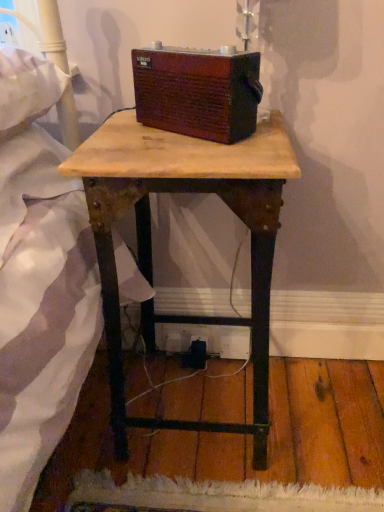
Describe the element at coordinates (197, 92) in the screenshot. I see `brown wood radio at center` at that location.

What is the approximate width of brown wood radio at center?

It is 10.28 centimeters.

Where is `brown wood radio at center`? The height and width of the screenshot is (512, 384). brown wood radio at center is located at coordinates (197, 92).

This screenshot has height=512, width=384. Describe the element at coordinates (151, 240) in the screenshot. I see `wooden table at center` at that location.

Image resolution: width=384 pixels, height=512 pixels. Find the location of `wooden table at center`. wooden table at center is located at coordinates (151, 240).

Measure the distance between wooden table at center and camera.

wooden table at center is 23.25 inches away from camera.

The height and width of the screenshot is (512, 384). I want to click on brown wood radio at center, so click(x=197, y=92).

Considering the positions of objects wooden table at center and brown wood radio at center in the image provided, who is more to the right, wooden table at center or brown wood radio at center?

From the viewer's perspective, brown wood radio at center appears more on the right side.

Consider the image. Which object is further away from the camera, wooden table at center or brown wood radio at center?

brown wood radio at center is behind.

Based on the photo, which is further, (141, 214) or (199, 100)?

Positioned behind is point (141, 214).

From the image's perspective, is wooden table at center located above or below brown wood radio at center?

Clearly, from the image's perspective, wooden table at center is below brown wood radio at center.

From a real-world perspective, which is physically above, wooden table at center or brown wood radio at center?

From a 3D spatial view, brown wood radio at center is above.

Considering the sizes of wooden table at center and brown wood radio at center in the image, is wooden table at center wider or thinner than brown wood radio at center?

wooden table at center is wider than brown wood radio at center.

From their relative heights in the image, would you say wooden table at center is taller or shorter than brown wood radio at center?

Clearly, wooden table at center is taller compared to brown wood radio at center.

Can you confirm if wooden table at center is bigger than brown wood radio at center?

Yes.

Is brown wood radio at center inside wooden table at center?

No, brown wood radio at center is located outside of wooden table at center.

Would you consider wooden table at center to be distant from brown wood radio at center?

No.

Could you tell me if wooden table at center is turned towards brown wood radio at center?

No.

Can you tell me how much wooden table at center and brown wood radio at center differ in facing direction?

There is a 36.6-degree angle between the facing directions of wooden table at center and brown wood radio at center.

Identify the location of table below the brown wood radio at center (from a real-world perspective). (151, 240).

Considering the relative positions of brown wood radio at center and wooden table at center in the image provided, is brown wood radio at center to the right of wooden table at center from the viewer's perspective?

Indeed, brown wood radio at center is positioned on the right side of wooden table at center.

In the scene shown: Relative to wooden table at center, is brown wood radio at center in front or behind?

brown wood radio at center is behind wooden table at center.

Considering the points (162, 83) and (189, 178), which point is behind, point (162, 83) or point (189, 178)?

Positioned behind is point (162, 83).

From the image's perspective, which object appears higher, brown wood radio at center or wooden table at center?

brown wood radio at center is shown above in the image.

From a real-world perspective, does brown wood radio at center sit lower than wooden table at center?

No, from a real-world perspective, brown wood radio at center is not below wooden table at center.

Which of these two, brown wood radio at center or wooden table at center, is wider?

With larger width is wooden table at center.

Does brown wood radio at center have a lesser height compared to wooden table at center?

Yes.

Which of these two, brown wood radio at center or wooden table at center, is smaller?

Smaller between the two is brown wood radio at center.

Do you think brown wood radio at center is within wooden table at center, or outside of it?

brown wood radio at center is outside wooden table at center.

Are brown wood radio at center and wooden table at center far apart?

No, brown wood radio at center is not far away from wooden table at center.

Is brown wood radio at center looking in the opposite direction of wooden table at center?

No, wooden table at center is not at the back of brown wood radio at center.

What's the angular difference between brown wood radio at center and wooden table at center's facing directions?

The angle between the facing direction of brown wood radio at center and the facing direction of wooden table at center is 36.6 degrees.

Measure the distance between brown wood radio at center and wooden table at center.

6.61 inches.

Identify the location of box above the wooden table at center (from a real-world perspective). (197, 92).

Where is `table in front of the brown wood radio at center`? This screenshot has width=384, height=512. table in front of the brown wood radio at center is located at coordinates (151, 240).

Where is `table directly beneath the brown wood radio at center (from a real-world perspective)`? table directly beneath the brown wood radio at center (from a real-world perspective) is located at coordinates (151, 240).